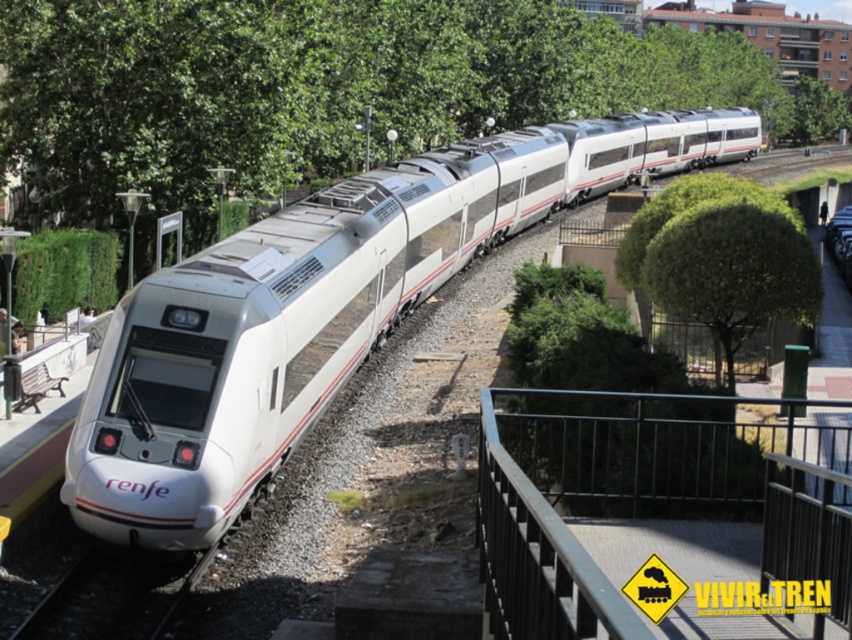
In the scene shown: Does white glossy bullet train at center come behind black metal train track at lower left?

That is True.

This screenshot has height=640, width=852. Describe the element at coordinates (281, 332) in the screenshot. I see `white glossy bullet train at center` at that location.

The image size is (852, 640). I want to click on white glossy bullet train at center, so click(x=281, y=332).

Where is `white glossy bullet train at center`? This screenshot has height=640, width=852. white glossy bullet train at center is located at coordinates (281, 332).

Which is above, white glossy bullet train at center or black metal/rail at center?

white glossy bullet train at center is above.

Can you confirm if white glossy bullet train at center is positioned to the right of black metal/rail at center?

Correct, you'll find white glossy bullet train at center to the right of black metal/rail at center.

The width and height of the screenshot is (852, 640). I want to click on white glossy bullet train at center, so click(281, 332).

Can you confirm if green leafy tree at center-right is taller than metallic silver car at center-right?

Incorrect, green leafy tree at center-right's height is not larger of metallic silver car at center-right's.

Is green leafy tree at center-right smaller than metallic silver car at center-right?

Indeed, green leafy tree at center-right has a smaller size compared to metallic silver car at center-right.

Is point (721, 209) positioned behind point (835, 230)?

No, (721, 209) is closer to viewer.

Identify the location of green leafy tree at center-right. (721, 259).